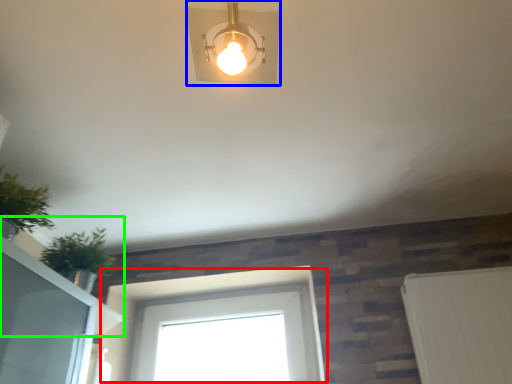
Question: Which object is the closest to the window (highlighted by a red box)? Choose among these: lamp (highlighted by a blue box) or window sill (highlighted by a green box).

Choices:
 (A) lamp
 (B) window sill

Answer: (B)